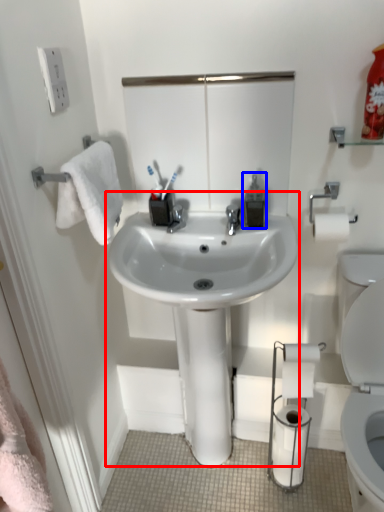
Question: Which object is closer to the camera taking this photo, sink (highlighted by a red box) or soap dispenser (highlighted by a blue box)?

Choices:
 (A) sink
 (B) soap dispenser

Answer: (A)